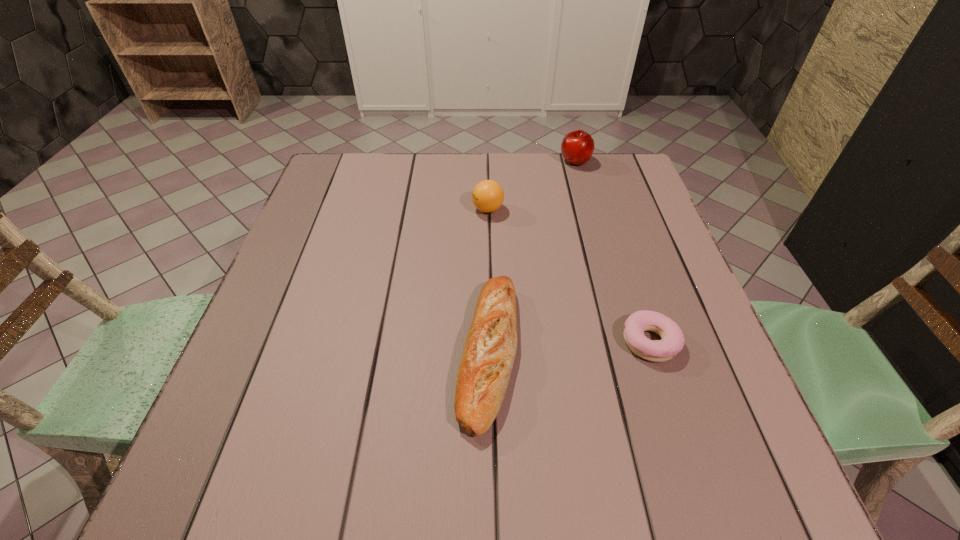
Locate an element on the screen. Image resolution: width=960 pixels, height=540 pixels. free spot between the second tallest object and the apple is located at coordinates (532, 185).

Identify which object is located as the second nearest to the apple. Please provide its 2D coordinates. Your answer should be formatted as a tuple, i.e. [(x, y)], where the tuple contains the x and y coordinates of a point satisfying the conditions above.

[(489, 352)]

Select which object appears as the third closest to the apple. Please provide its 2D coordinates. Your answer should be formatted as a tuple, i.e. [(x, y)], where the tuple contains the x and y coordinates of a point satisfying the conditions above.

[(673, 340)]

The image size is (960, 540). I want to click on vacant space that satisfies the following two spatial constraints: 1. on the front side of the apple; 2. on the side with brand of the ping-pong ball, so click(588, 210).

At what (x,y) coordinates should I click in order to perform the action: click on free space that satisfies the following two spatial constraints: 1. on the side with brand of the ping-pong ball; 2. on the left side of the shortest object. Please return your answer as a coordinate pair (x, y). This screenshot has width=960, height=540. Looking at the image, I should click on (491, 342).

The image size is (960, 540). What are the coordinates of `blank area in the image that satisfies the following two spatial constraints: 1. on the side with brand of the ping-pong ball; 2. on the back side of the shortest object` in the screenshot? It's located at (491, 342).